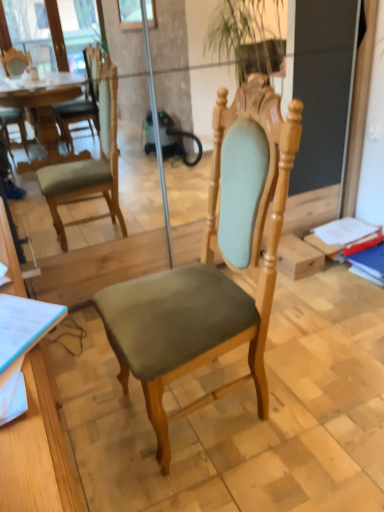
Question: Considering the relative positions of wooden desk at lower left and matte green fabric chair at center in the image provided, is wooden desk at lower left to the left or to the right of matte green fabric chair at center?

Choices:
 (A) left
 (B) right

Answer: (A)

Question: Is wooden desk at lower left wider or thinner than matte green fabric chair at center?

Choices:
 (A) thin
 (B) wide

Answer: (A)

Question: Considering the positions of point (36, 494) and point (177, 324), is point (36, 494) closer or farther from the camera than point (177, 324)?

Choices:
 (A) farther
 (B) closer

Answer: (B)

Question: Is matte green fabric chair at center taller or shorter than wooden desk at lower left?

Choices:
 (A) short
 (B) tall

Answer: (B)

Question: From the image's perspective, is matte green fabric chair at center located above or below wooden desk at lower left?

Choices:
 (A) below
 (B) above

Answer: (B)

Question: Is point (251, 179) positioned closer to the camera than point (18, 422)?

Choices:
 (A) closer
 (B) farther

Answer: (B)

Question: From a real-world perspective, is matte green fabric chair at center above or below wooden desk at lower left?

Choices:
 (A) below
 (B) above

Answer: (B)